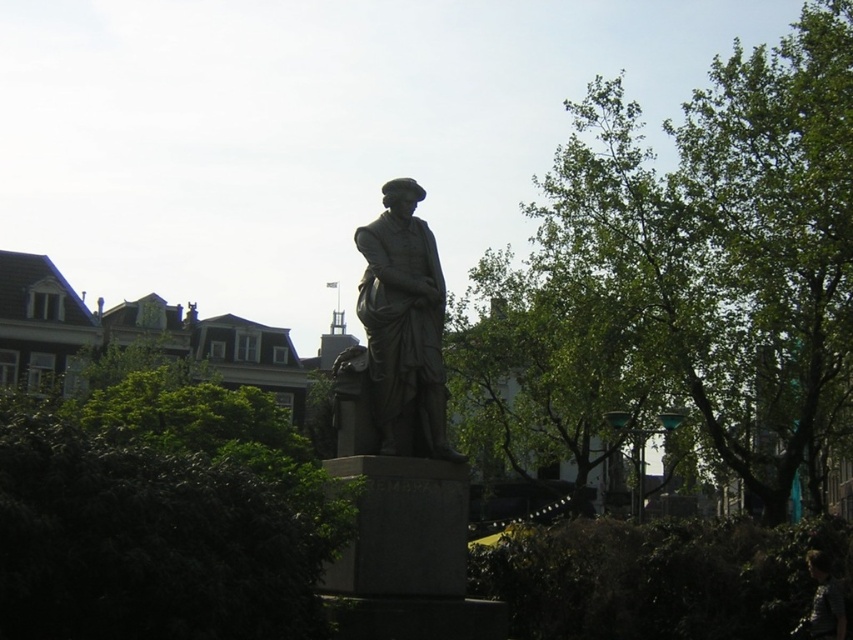
Does green leafy tree at center appear under green leafy bush at center?

No, green leafy tree at center is not below green leafy bush at center.

Is green leafy tree at center thinner than green leafy bush at center?

No, green leafy tree at center is not thinner than green leafy bush at center.

Describe the element at coordinates (726, 243) in the screenshot. I see `green leafy tree at center` at that location.

The height and width of the screenshot is (640, 853). I want to click on green leafy tree at center, so click(x=726, y=243).

Which is below, green leafy bush at center or dark brown hair at lower right?

dark brown hair at lower right is below.

In order to click on green leafy bush at center in this screenshot , I will do `click(161, 509)`.

From the picture: Is bronze statue at center further to camera compared to dark brown hair at lower right?

No, it is in front of dark brown hair at lower right.

This screenshot has height=640, width=853. Find the location of `bronze statue at center`. bronze statue at center is located at coordinates (403, 326).